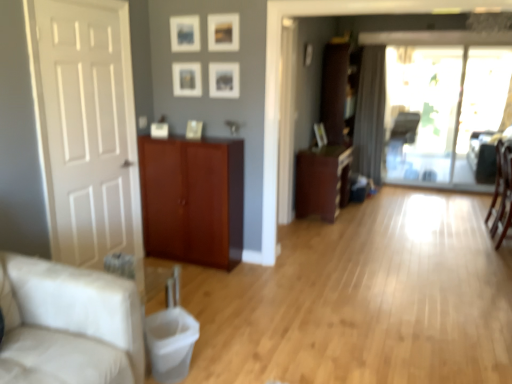
Question: Is matte wood cabinet at center, which is the 2th cabinetry in left-to-right order, not inside beige fabric couch at left?

Choices:
 (A) yes
 (B) no

Answer: (A)

Question: Considering the relative sizes of matte wood cabinet at center, which ranks as the second cabinetry in back-to-front order, and beige fabric couch at left in the image provided, is matte wood cabinet at center, which ranks as the second cabinetry in back-to-front order, smaller than beige fabric couch at left?

Choices:
 (A) no
 (B) yes

Answer: (B)

Question: Is matte wood cabinet at center, placed as the second cabinetry when sorted from front to back, bigger than beige fabric couch at left?

Choices:
 (A) yes
 (B) no

Answer: (B)

Question: From the image's perspective, is matte wood cabinet at center, which ranks as the second cabinetry in back-to-front order, over beige fabric couch at left?

Choices:
 (A) no
 (B) yes

Answer: (B)

Question: Considering the relative sizes of matte wood cabinet at center, placed as the second cabinetry when sorted from front to back, and beige fabric couch at left in the image provided, is matte wood cabinet at center, placed as the second cabinetry when sorted from front to back, thinner than beige fabric couch at left?

Choices:
 (A) no
 (B) yes

Answer: (B)

Question: In the image, is transparent glass door at center positioned in front of or behind brown wood cabinet at center, the third cabinetry positioned from the left?

Choices:
 (A) behind
 (B) front

Answer: (A)

Question: Based on their positions, is transparent glass door at center located to the left or right of brown wood cabinet at center, which is counted as the 3th cabinetry, starting from the front?

Choices:
 (A) left
 (B) right

Answer: (B)

Question: Looking at their shapes, would you say transparent glass door at center is wider or thinner than brown wood cabinet at center, which is counted as the 3th cabinetry, starting from the front?

Choices:
 (A) thin
 (B) wide

Answer: (A)

Question: From a real-world perspective, is transparent glass door at center physically located above or below brown wood cabinet at center, marked as the 1th cabinetry in a right-to-left arrangement?

Choices:
 (A) below
 (B) above

Answer: (A)

Question: Does point (302, 183) appear closer or farther from the camera than point (326, 100)?

Choices:
 (A) farther
 (B) closer

Answer: (B)

Question: Is matte wood cabinet at center, placed as the second cabinetry when sorted from front to back, wider or thinner than brown wood cabinet at center, which is counted as the 3th cabinetry, starting from the front?

Choices:
 (A) thin
 (B) wide

Answer: (B)

Question: Do you think matte wood cabinet at center, placed as the second cabinetry when sorted from front to back, is within brown wood cabinet at center, which is counted as the 3th cabinetry, starting from the front, or outside of it?

Choices:
 (A) inside
 (B) outside

Answer: (B)

Question: Relative to brown wood cabinet at center, the first cabinetry when ordered from back to front, is matte wood cabinet at center, the 2th cabinetry when ordered from right to left, in front or behind?

Choices:
 (A) front
 (B) behind

Answer: (A)

Question: Would you say beige fabric couch at left is inside or outside mahogany wood cabinet at center, which is the third cabinetry from right to left?

Choices:
 (A) outside
 (B) inside

Answer: (A)

Question: Is point (100, 367) closer or farther from the camera than point (202, 223)?

Choices:
 (A) farther
 (B) closer

Answer: (B)